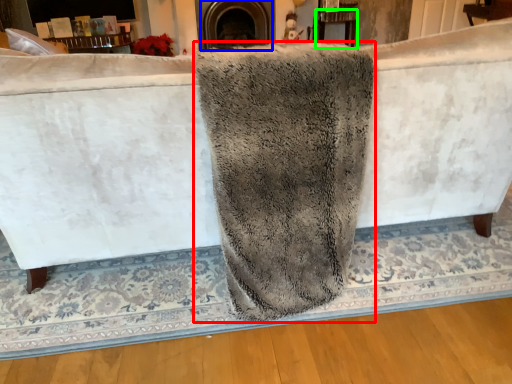
Question: Which is nearer to the bath towel (highlighted by a red box)? fireplace (highlighted by a blue box) or table (highlighted by a green box).

Choices:
 (A) fireplace
 (B) table

Answer: (A)